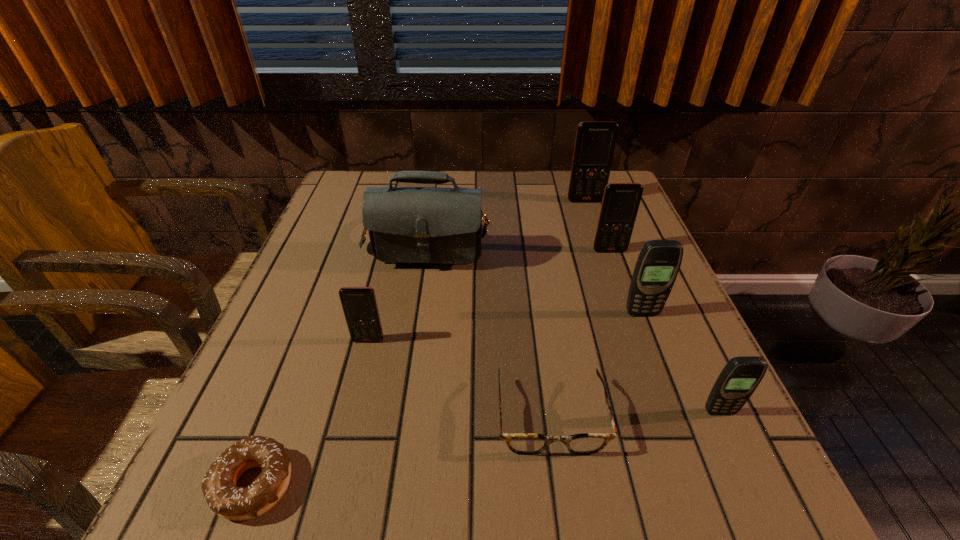
This screenshot has height=540, width=960. Identify the location of vacant space located on the right of the chocolate doughnut. (404, 483).

You are a GUI agent. You are given a task and a screenshot of the screen. Output one action in this format:
    pyautogui.click(x=<x>, y=<y>)
    Task: Click on the cellular telephone located in the far edge section of the desktop
    
    Given the screenshot: What is the action you would take?
    pyautogui.click(x=595, y=143)

Image resolution: width=960 pixels, height=540 pixels. I want to click on shoulder bag located at the far edge, so pos(438,225).

Where is `object that is at the near edge`? The image size is (960, 540). object that is at the near edge is located at coordinates (219, 486).

You are a GUI agent. You are given a task and a screenshot of the screen. Output one action in this format:
    pyautogui.click(x=<x>, y=<y>)
    Task: Click on the shoulder bag at the left edge
    
    Given the screenshot: What is the action you would take?
    pyautogui.click(x=438, y=225)

Where is `doughnut present at the left edge`? The image size is (960, 540). doughnut present at the left edge is located at coordinates point(219,486).

Identify the location of object situated at the far left corner. (438, 225).

The height and width of the screenshot is (540, 960). I want to click on object that is at the near left corner, so click(219, 486).

Locate an element on the screen. object located at the far right corner is located at coordinates (595, 143).

This screenshot has height=540, width=960. I want to click on vacant space at the far edge, so click(542, 190).